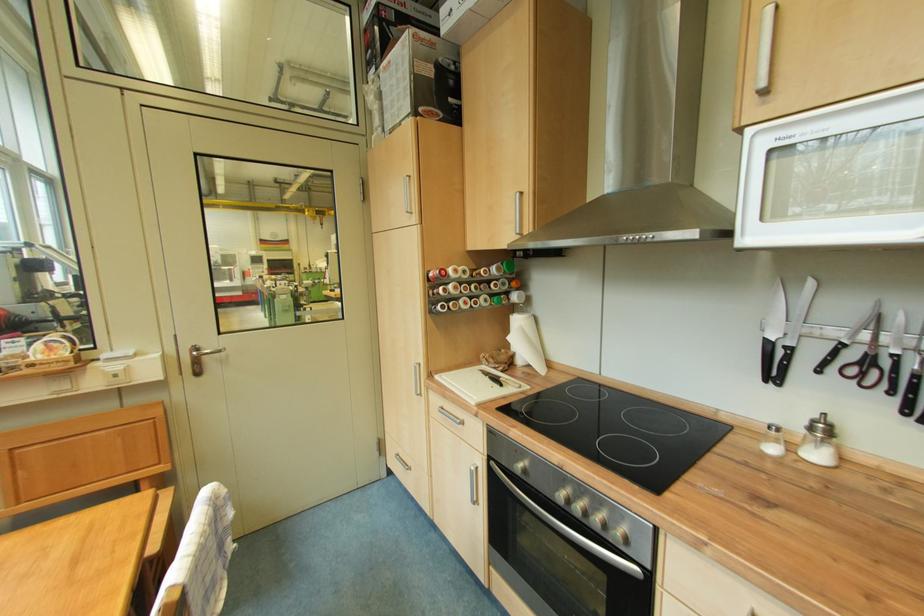
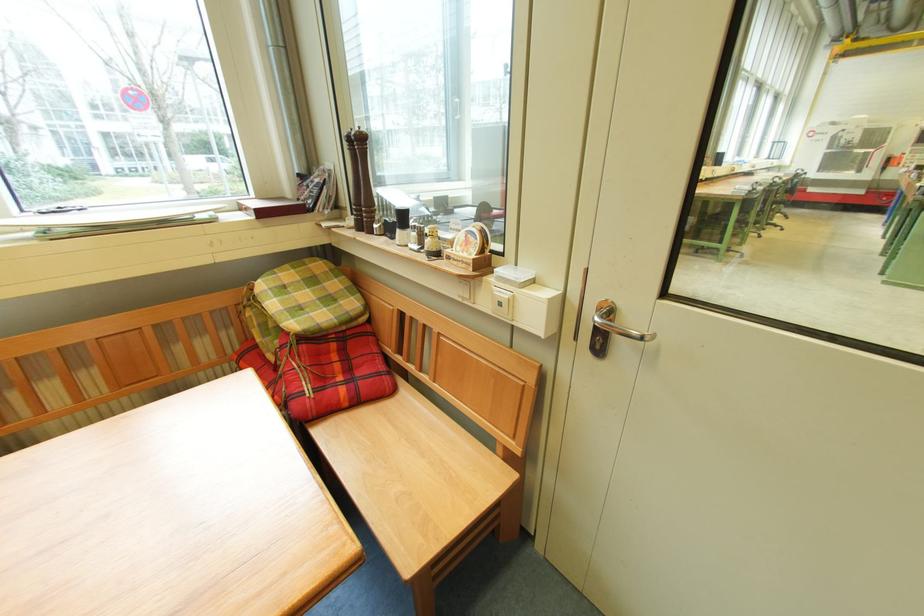
In the second image, find the point that corresponds to the point at 123,379 in the first image.

(507, 307)